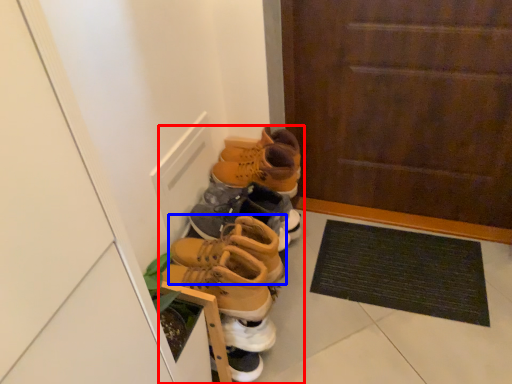
Question: Among these objects, which one is farthest to the camera, footwear (highlighted by a red box) or footwear (highlighted by a blue box)?

Choices:
 (A) footwear
 (B) footwear

Answer: (B)